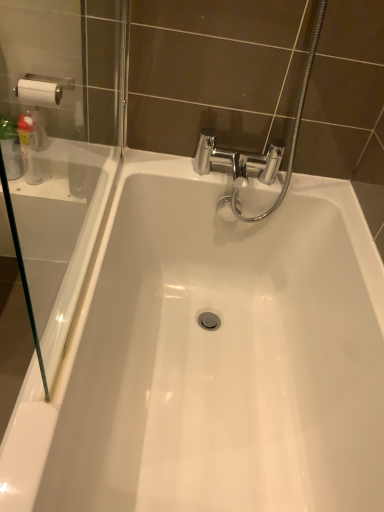
Where is `free space underneath transparent glass screen door at left (from a real-world perspective)`? The height and width of the screenshot is (512, 384). free space underneath transparent glass screen door at left (from a real-world perspective) is located at coordinates (88, 261).